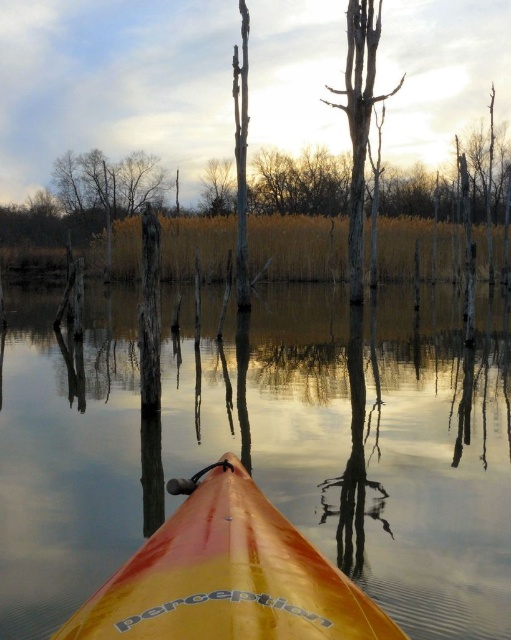
Between yellow glossy kayak at center and brown wood tree at upper center, which one is positioned higher?

brown wood tree at upper center is above.

Is point (376, 611) more distant than point (220, 180)?

No, (376, 611) is in front of (220, 180).

At what (x,y) coordinates should I click in order to perform the action: click on yellow glossy kayak at center. Please return your answer as a coordinate pair (x, y). This screenshot has height=640, width=511. Looking at the image, I should click on (227, 576).

Between glossy water at center and brown wood tree at upper center, which one is positioned lower?

glossy water at center is below.

Who is taller, glossy water at center or brown wood tree at upper center?

Standing taller between the two is brown wood tree at upper center.

Does point (174, 410) lie behind point (233, 209)?

No, (174, 410) is closer to viewer.

The height and width of the screenshot is (640, 511). I want to click on glossy water at center, so pos(266,445).

Who is taller, glossy water at center or bare wood tree at center?

bare wood tree at center

Which is behind, point (340, 426) or point (362, 256)?

Positioned behind is point (362, 256).

Where is `glossy water at center`? glossy water at center is located at coordinates (266, 445).